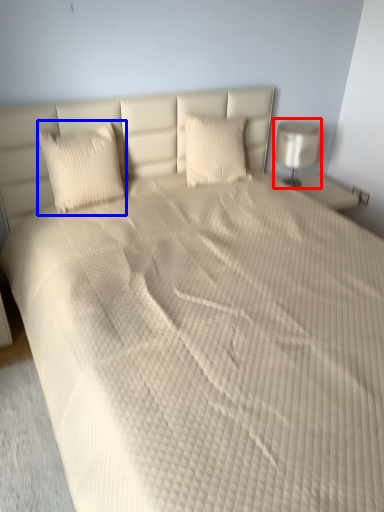
Question: Which of the following is the farthest to the observer, lamp (highlighted by a red box) or pillow (highlighted by a blue box)?

Choices:
 (A) lamp
 (B) pillow

Answer: (A)